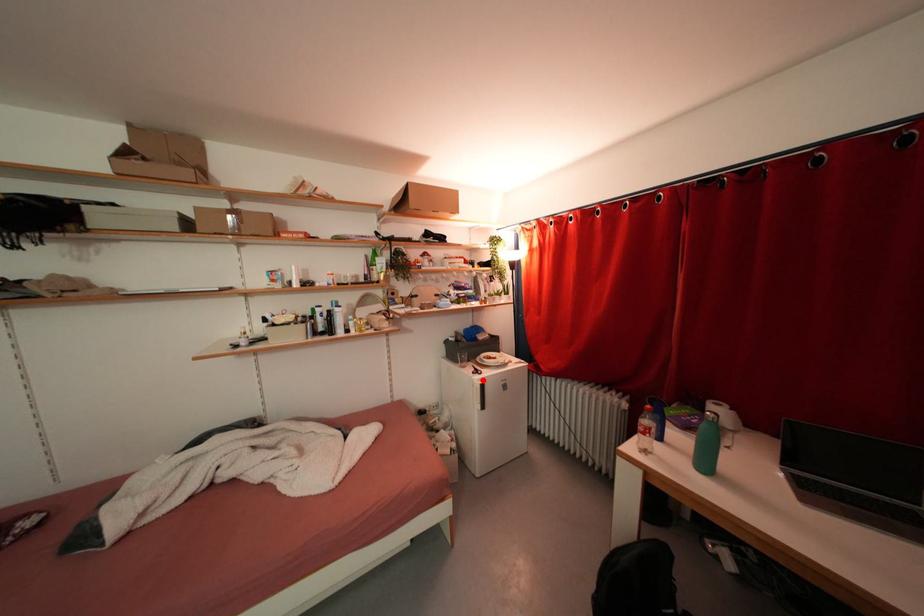
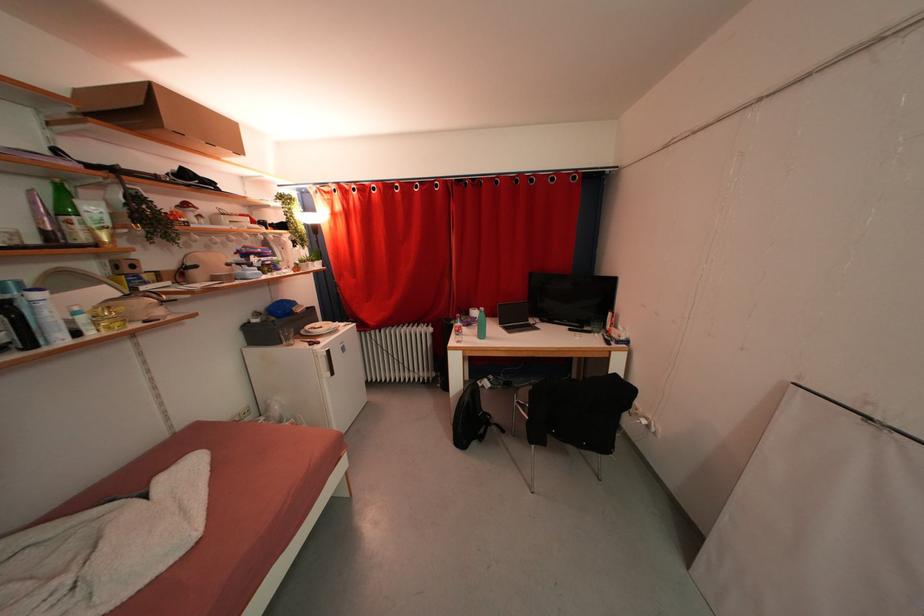
Question: I am providing you with two images of the same scene from different viewpoints. Given a red point in image1, look at the same physical point in image2. Is it:

Choices:
 (A) Closer to the viewpoint
 (B) Farther from the viewpoint

Answer: (A)